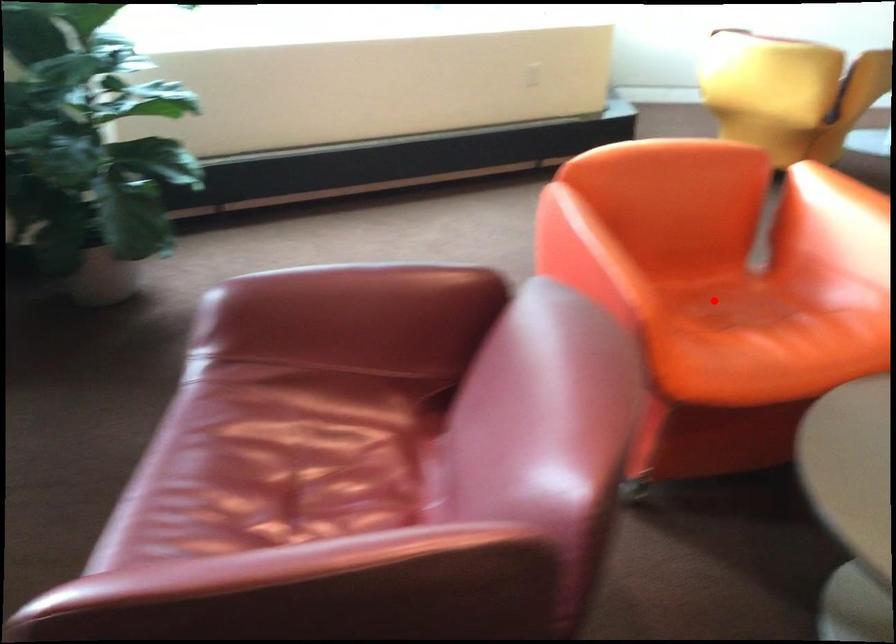
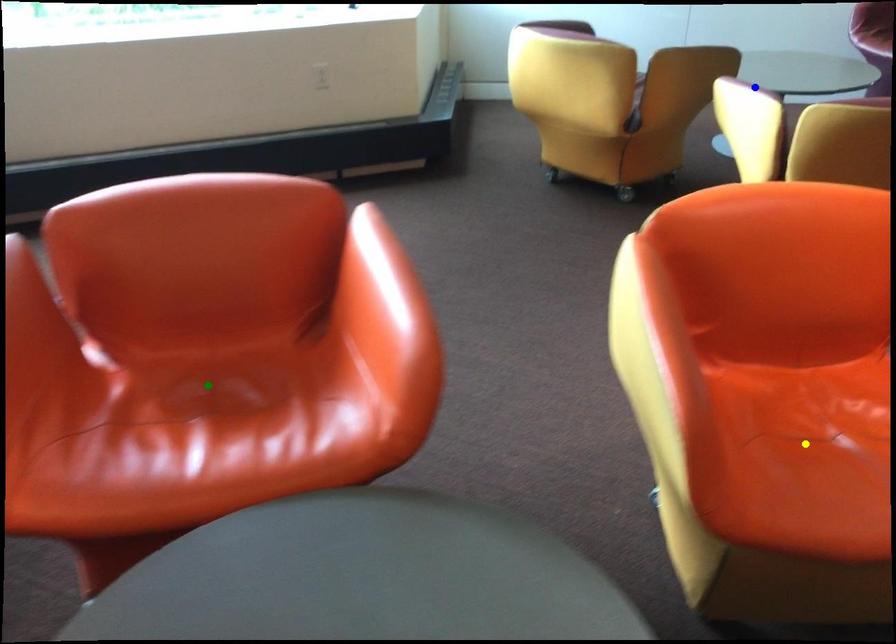
Question: I am providing you with two images of the same scene from different viewpoints. A red point is marked on the first image. You are given multiple points on the second image. Which spot in image 2 lines up with the point in image 1?

Choices:
 (A) green point
 (B) blue point
 (C) yellow point

Answer: (A)